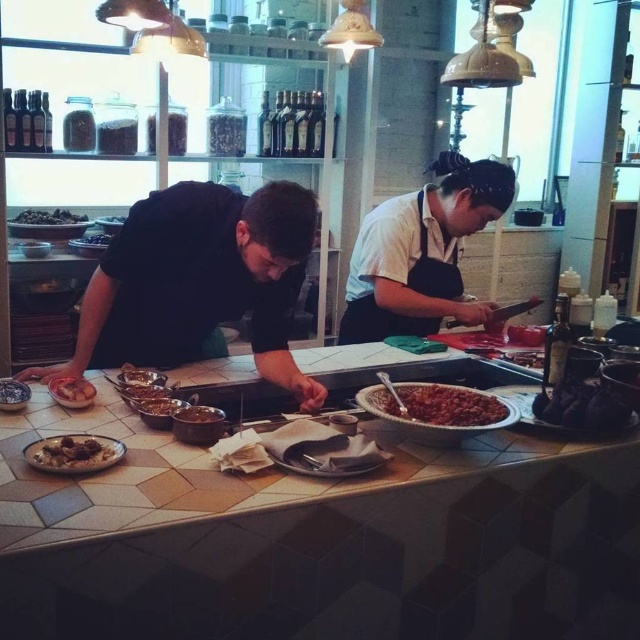
You are a chef in the kitchen and need to retrieve the matte silver bowl at center. Can you directly access it without moving the brown matte bowl at center?

The brown matte bowl at center is positioned over the matte silver bowl at center, so you cannot directly access the matte silver bowl at center without moving the brown matte bowl at center first.

You are a chef in a busy kitchen. You need to quickly grab both the brown matte bowl at center and the matte silver bowl at center. Given that your reach is 24 inches, can you reach both bowls without moving your position?

The brown matte bowl at center and the matte silver bowl at center are 24.81 inches apart from each other. Since your reach is only 24 inches, you cannot reach both bowls at the same time without moving your position.